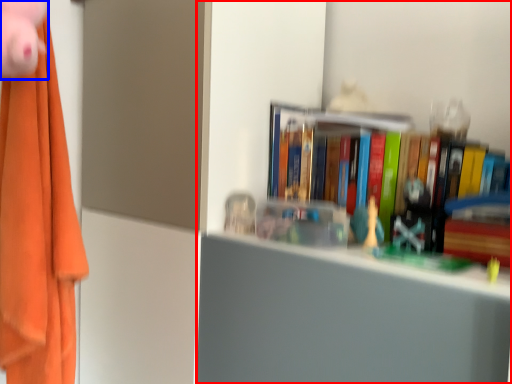
Question: Which object appears closest to the camera in this image, bookcase (highlighted by a red box) or toy (highlighted by a blue box)?

Choices:
 (A) bookcase
 (B) toy

Answer: (A)